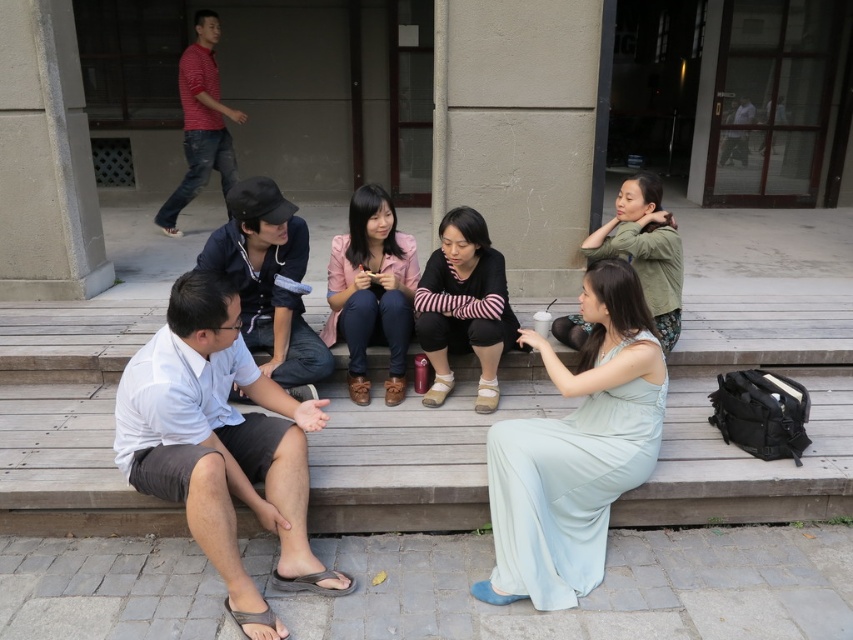
Consider the image. Is light blue silk dress at lower right behind pink matte jacket at center?

That is False.

Does light blue silk dress at lower right have a greater width compared to pink matte jacket at center?

Yes, light blue silk dress at lower right is wider than pink matte jacket at center.

Locate an element on the screen. The width and height of the screenshot is (853, 640). light blue silk dress at lower right is located at coordinates tap(576, 451).

Where is `light blue silk dress at lower right`? light blue silk dress at lower right is located at coordinates (576, 451).

In the scene shown: Who is shorter, light blue silk dress at lower right or black striped sweater at center?

With less height is black striped sweater at center.

How much distance is there between light blue silk dress at lower right and black striped sweater at center?

light blue silk dress at lower right and black striped sweater at center are 25.45 inches apart.

Between point (614, 470) and point (467, 294), which one is positioned behind?

The point (467, 294) is more distant.

Locate an element on the screen. light blue silk dress at lower right is located at coordinates (576, 451).

Does pink matte jacket at center have a lesser height compared to matte green shirt at upper right?

Incorrect, pink matte jacket at center's height does not fall short of matte green shirt at upper right's.

Is pink matte jacket at center further to the viewer compared to matte green shirt at upper right?

Yes, pink matte jacket at center is behind matte green shirt at upper right.

What do you see at coordinates (370, 291) in the screenshot? The width and height of the screenshot is (853, 640). I see `pink matte jacket at center` at bounding box center [370, 291].

Locate an element on the screen. The width and height of the screenshot is (853, 640). pink matte jacket at center is located at coordinates (370, 291).